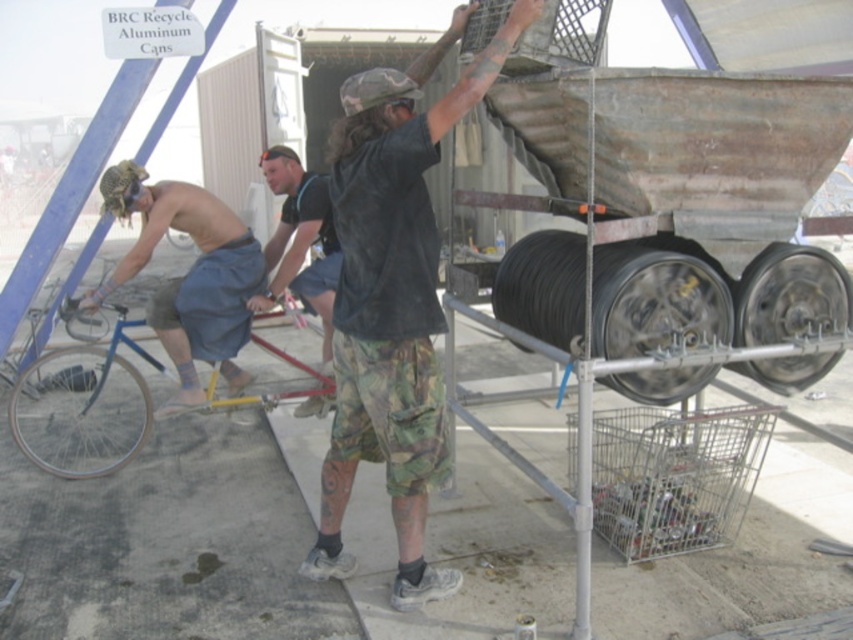
Who is more forward, [27,442] or [80,308]?

Positioned in front is point [80,308].

Is silver metallic bicycle wheel at left positioned at the back of metallic silver wheel at left?

No.

This screenshot has height=640, width=853. What do you see at coordinates (80, 412) in the screenshot?
I see `silver metallic bicycle wheel at left` at bounding box center [80, 412].

You are a GUI agent. You are given a task and a screenshot of the screen. Output one action in this format:
    pyautogui.click(x=<x>, y=<y>)
    Task: Click on the silver metallic bicycle wheel at left
    The width and height of the screenshot is (853, 640).
    Given the screenshot: What is the action you would take?
    pyautogui.click(x=80, y=412)

Is the position of blue matte bicycle at left more distant than that of metallic silver wheel at left?

No, it is not.

Measure the distance from blue matte bicycle at left to metallic silver wheel at left.

blue matte bicycle at left and metallic silver wheel at left are 2.15 meters apart.

Is point (265, 396) more distant than point (82, 323)?

No, it is in front of (82, 323).

Find the location of a particular element. blue matte bicycle at left is located at coordinates pyautogui.click(x=84, y=408).

Can you confirm if black rubber tire at center is positioned to the left of silver metallic bicycle wheel at left?

In fact, black rubber tire at center is to the right of silver metallic bicycle wheel at left.

Describe the element at coordinates (656, 301) in the screenshot. The height and width of the screenshot is (640, 853). I see `black rubber tire at center` at that location.

Where is `black rubber tire at center`? This screenshot has height=640, width=853. black rubber tire at center is located at coordinates (656, 301).